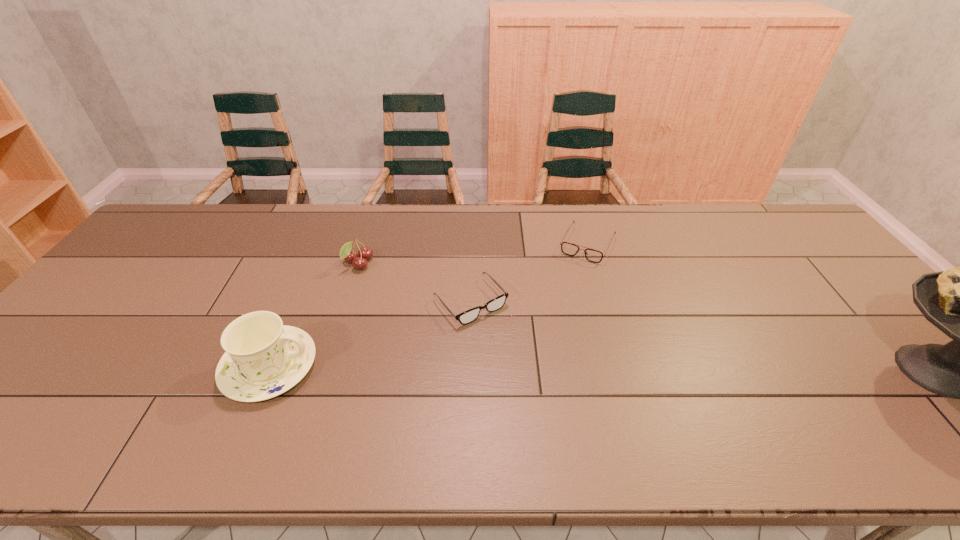
Where is `blank area in the image that satisfies the following two spatial constraints: 1. on the back side of the cherry; 2. on the right side of the fourth object from left to right`? This screenshot has height=540, width=960. blank area in the image that satisfies the following two spatial constraints: 1. on the back side of the cherry; 2. on the right side of the fourth object from left to right is located at coordinates (365, 245).